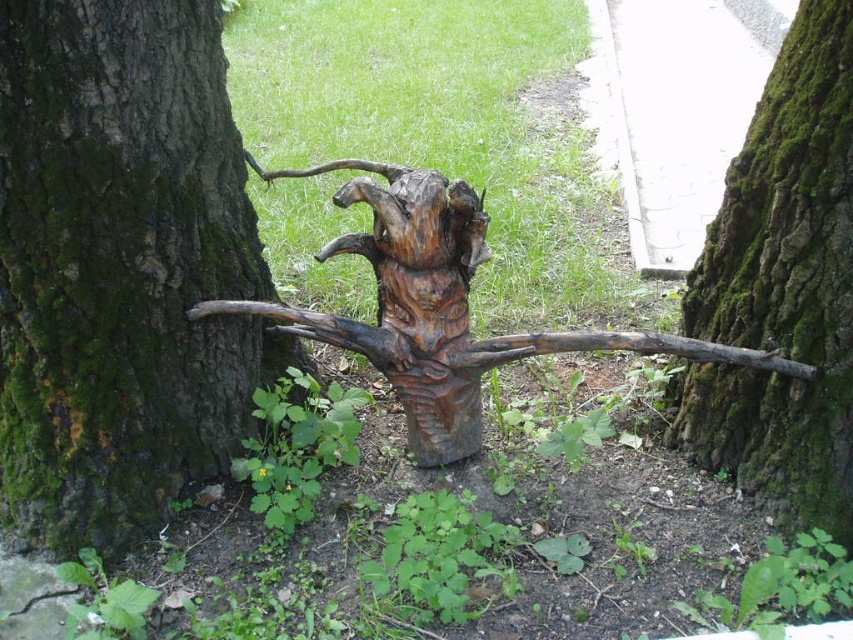
Consider the image. You are a gardener who wants to place a new decorative rock between the green mossy bark at center and the natural wood sculpture at center. Given their sizes, which object should the rock be placed closer to?

The green mossy bark at center is smaller than the natural wood sculpture at center, so the rock should be placed closer to the green mossy bark at center to balance their sizes.

You are a landscape architect designing a garden pathway. You need to place a decorative stone between the dark brown wood at center and the natural wood sculpture at center. Which object should the stone be closer to to ensure it doesn

The stone should be placed closer to the dark brown wood at center because it occupies less space than the natural wood sculpture at center, making it a better location for a smaller decorative element.

You are an artist planning to paint the dark brown wood at center and the natural wood sculpture at center. Since you want to ensure you can see both clearly while working, which object should you stand closer to, and why?

You should stand closer to the dark brown wood at center because it is in front of the natural wood sculpture at center, so being closer allows you to focus on the foreground object without obstruction.